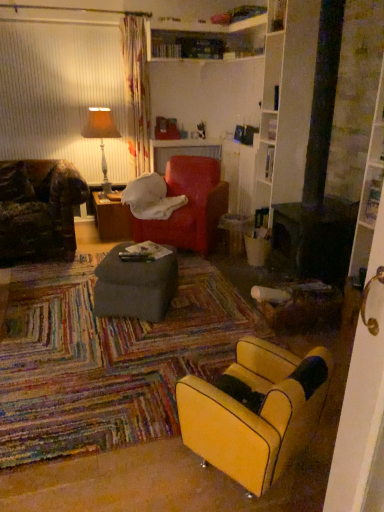
Question: Is velvet red bean bag chair at center further to the viewer compared to matte gray ottoman at center, the 2th table in the back-to-front sequence?

Choices:
 (A) no
 (B) yes

Answer: (B)

Question: Can you confirm if velvet red bean bag chair at center is positioned to the left of matte gray ottoman at center, the 2th table in the back-to-front sequence?

Choices:
 (A) yes
 (B) no

Answer: (B)

Question: Is velvet red bean bag chair at center not close to matte gray ottoman at center, acting as the 2th table starting from the left?

Choices:
 (A) no
 (B) yes

Answer: (B)

Question: Is velvet red bean bag chair at center turned away from matte gray ottoman at center, which appears as the first table when viewed from the right?

Choices:
 (A) no
 (B) yes

Answer: (A)

Question: Is velvet red bean bag chair at center not inside matte gray ottoman at center, the first table viewed from the front?

Choices:
 (A) yes
 (B) no

Answer: (A)

Question: Is matte gray ottoman at center, the 1th table from the bottom, situated inside orange fabric lampshade at upper left or outside?

Choices:
 (A) inside
 (B) outside

Answer: (B)

Question: Considering the relative positions of matte gray ottoman at center, the 2th table in the back-to-front sequence, and orange fabric lampshade at upper left in the image provided, is matte gray ottoman at center, the 2th table in the back-to-front sequence, to the left or to the right of orange fabric lampshade at upper left?

Choices:
 (A) left
 (B) right

Answer: (B)

Question: From the image's perspective, is matte gray ottoman at center, the 1th table from the bottom, located above or below orange fabric lampshade at upper left?

Choices:
 (A) below
 (B) above

Answer: (A)

Question: Considering the positions of matte gray ottoman at center, the first table viewed from the front, and orange fabric lampshade at upper left in the image, is matte gray ottoman at center, the first table viewed from the front, wider or thinner than orange fabric lampshade at upper left?

Choices:
 (A) wide
 (B) thin

Answer: (A)

Question: Considering the positions of orange fabric lampshade at upper left and velvet red bean bag chair at center in the image, is orange fabric lampshade at upper left taller or shorter than velvet red bean bag chair at center?

Choices:
 (A) tall
 (B) short

Answer: (A)

Question: Is orange fabric lampshade at upper left wider or thinner than velvet red bean bag chair at center?

Choices:
 (A) thin
 (B) wide

Answer: (A)

Question: Considering the relative positions of orange fabric lampshade at upper left and velvet red bean bag chair at center in the image provided, is orange fabric lampshade at upper left to the left or to the right of velvet red bean bag chair at center?

Choices:
 (A) right
 (B) left

Answer: (B)

Question: From a real-world perspective, relative to velvet red bean bag chair at center, is orange fabric lampshade at upper left vertically above or below?

Choices:
 (A) above
 (B) below

Answer: (A)

Question: Considering the positions of brown wood table at center, the first table when ordered from top to bottom, and matte gray ottoman at center, the 2th table in the back-to-front sequence, in the image, is brown wood table at center, the first table when ordered from top to bottom, wider or thinner than matte gray ottoman at center, the 2th table in the back-to-front sequence,?

Choices:
 (A) wide
 (B) thin

Answer: (A)

Question: From the image's perspective, is brown wood table at center, which ranks as the 1th table in left-to-right order, positioned above or below matte gray ottoman at center, which appears as the first table when viewed from the right?

Choices:
 (A) above
 (B) below

Answer: (A)